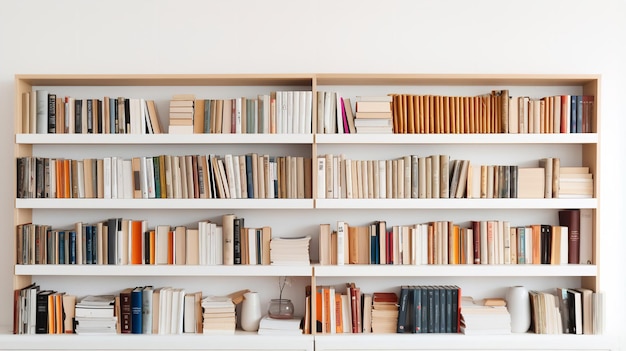
The width and height of the screenshot is (626, 351). Find the location of `shelf`. shelf is located at coordinates (428, 139), (424, 199), (424, 269), (417, 341), (254, 341), (222, 270), (227, 204), (226, 137).